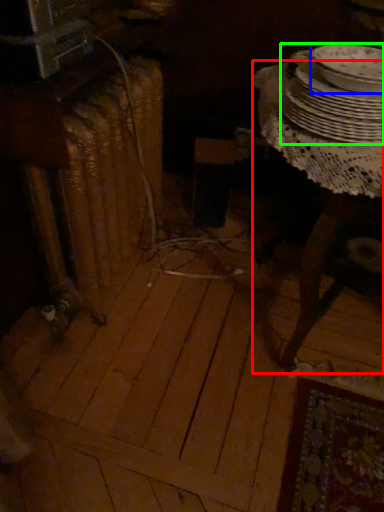
Question: Which object is the farthest from table (highlighted by a red box)? Choose among these: tableware (highlighted by a blue box) or tableware (highlighted by a green box).

Choices:
 (A) tableware
 (B) tableware

Answer: (A)